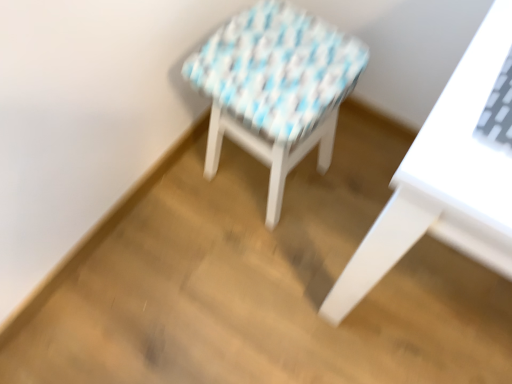
Question: From the image's perspective, relative to white glossy table at right, is white woven stool at center above or below?

Choices:
 (A) below
 (B) above

Answer: (B)

Question: Is point (251, 26) positioned closer to the camera than point (436, 112)?

Choices:
 (A) farther
 (B) closer

Answer: (A)

Question: In terms of width, does white woven stool at center look wider or thinner when compared to white glossy table at right?

Choices:
 (A) wide
 (B) thin

Answer: (B)

Question: Choose the correct answer: Is white glossy table at right inside white woven stool at center or outside it?

Choices:
 (A) outside
 (B) inside

Answer: (A)

Question: Considering their positions, is white glossy table at right located in front of or behind white woven stool at center?

Choices:
 (A) front
 (B) behind

Answer: (A)

Question: From their relative heights in the image, would you say white glossy table at right is taller or shorter than white woven stool at center?

Choices:
 (A) short
 (B) tall

Answer: (B)

Question: In terms of size, does white glossy table at right appear bigger or smaller than white woven stool at center?

Choices:
 (A) small
 (B) big

Answer: (B)